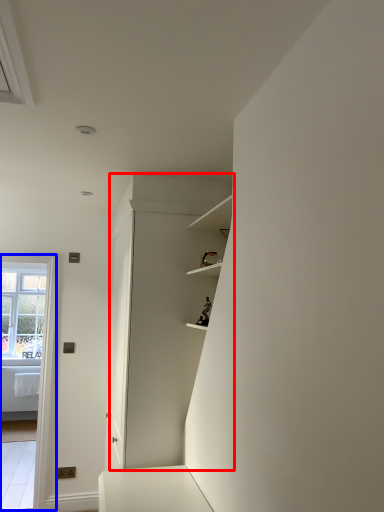
Question: Which point is further to the camera, dresser (highlighted by a red box) or glass door (highlighted by a blue box)?

Choices:
 (A) dresser
 (B) glass door

Answer: (B)